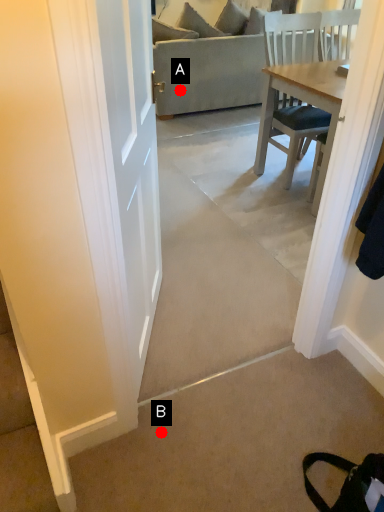
Question: Two points are circled on the image, labeled by A and B beside each circle. Which point appears farthest from the camera in this image?

Choices:
 (A) A is further
 (B) B is further

Answer: (A)